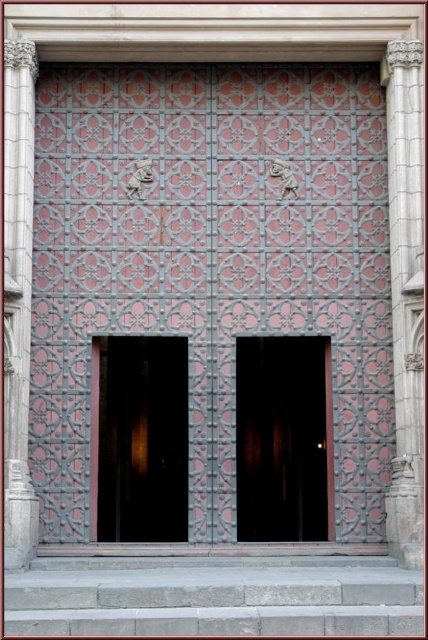
Based on the photo, does dark wood door at center appear on the left side of metallic glass door at center?

In fact, dark wood door at center is to the right of metallic glass door at center.

Is point (308, 340) positioned after point (107, 388)?

Yes, point (308, 340) is behind point (107, 388).

Find the location of `dark wood door at center`. dark wood door at center is located at coordinates (281, 438).

Is metallic glass door at center above carved stone column at right?

No.

Where is `metallic glass door at center`? Image resolution: width=428 pixels, height=640 pixels. metallic glass door at center is located at coordinates (142, 438).

Identify the location of metallic glass door at center. This screenshot has height=640, width=428. (142, 438).

Between dark wood door at center and carved stone column at right, which one is positioned higher?

Positioned higher is carved stone column at right.

Is dark wood door at center below carved stone column at right?

Yes.

Who is more distant from viewer, (315, 436) or (419, 456)?

The point (315, 436) is more distant.

You are a GUI agent. You are given a task and a screenshot of the screen. Output one action in this format:
    pyautogui.click(x=<x>, y=<y>)
    Task: Click on the dark wood door at center
    Image resolution: width=428 pixels, height=640 pixels.
    Given the screenshot: What is the action you would take?
    pyautogui.click(x=281, y=438)